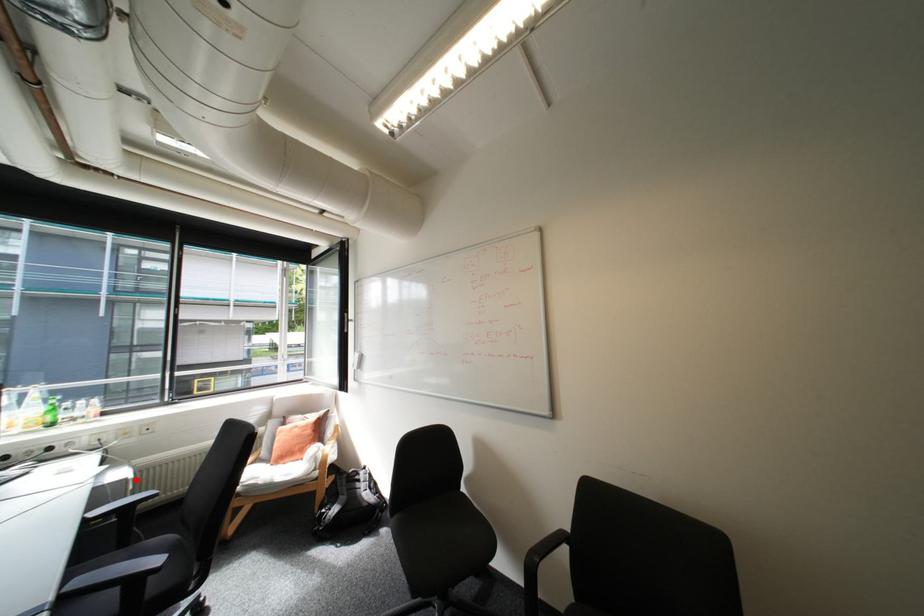
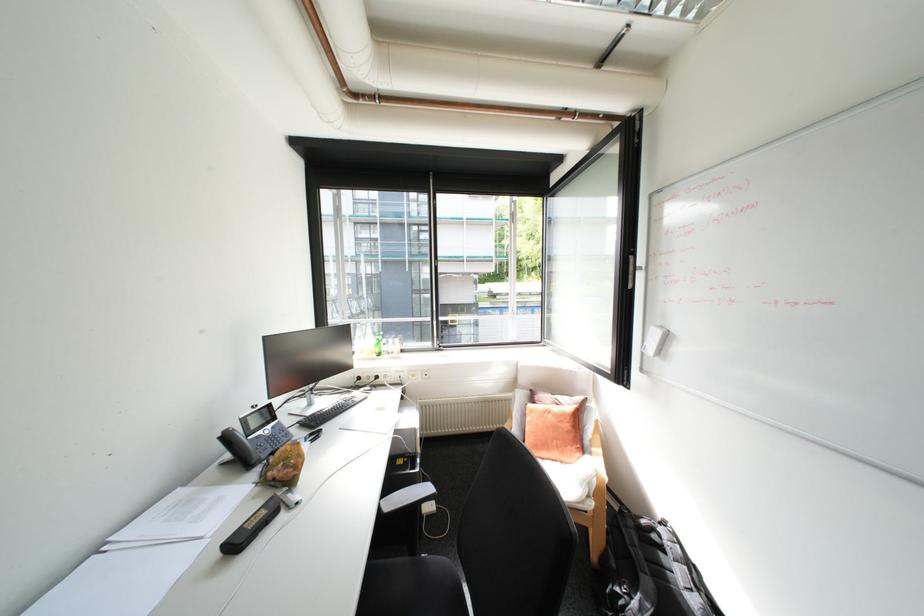
Question: I am providing you with two images of the same scene from different viewpoints. In image1, a red point is highlighted. Considering the same 3D point in image2, which of the following is correct?

Choices:
 (A) It is closer
 (B) It is farther

Answer: (A)